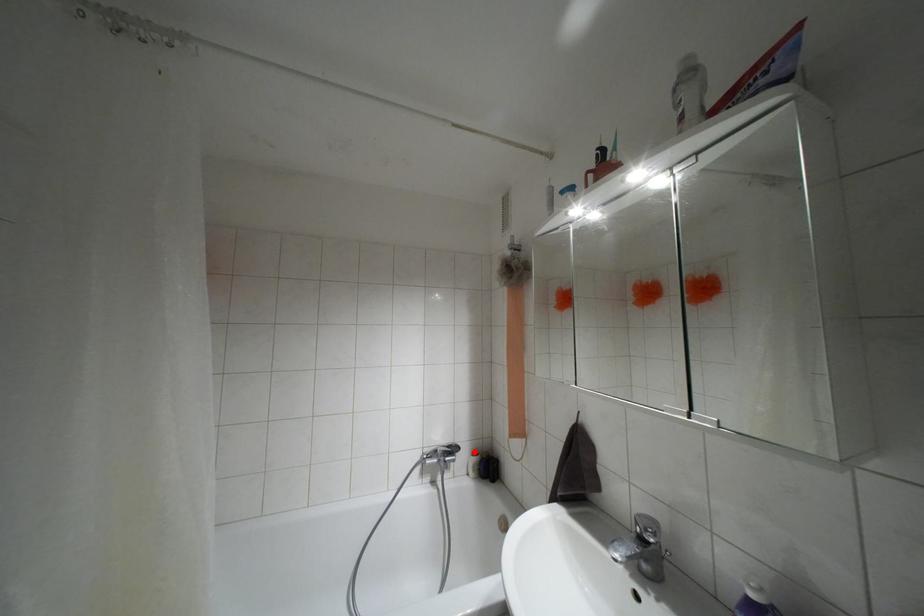
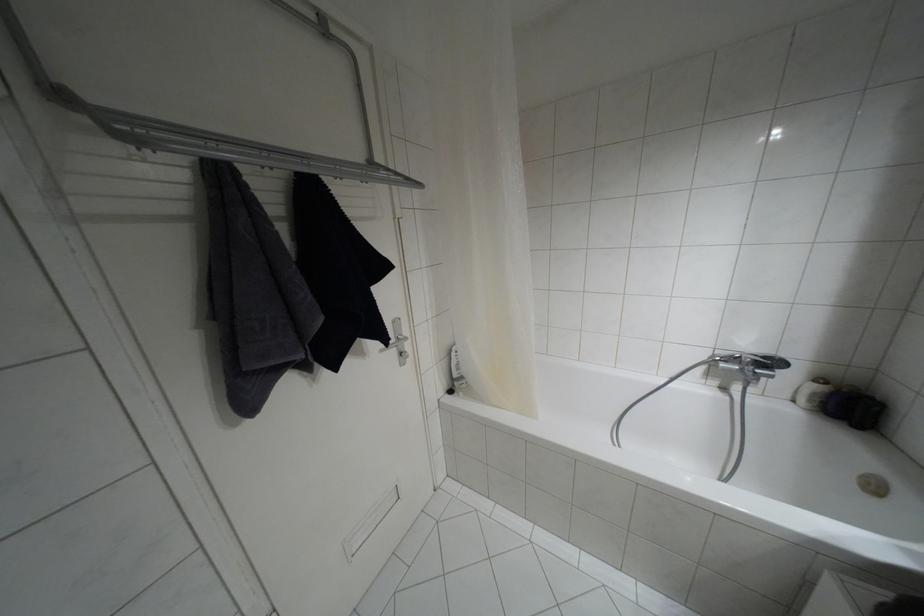
Locate, in the second image, the point that corresponds to the highlighted location in the first image.

(820, 379)